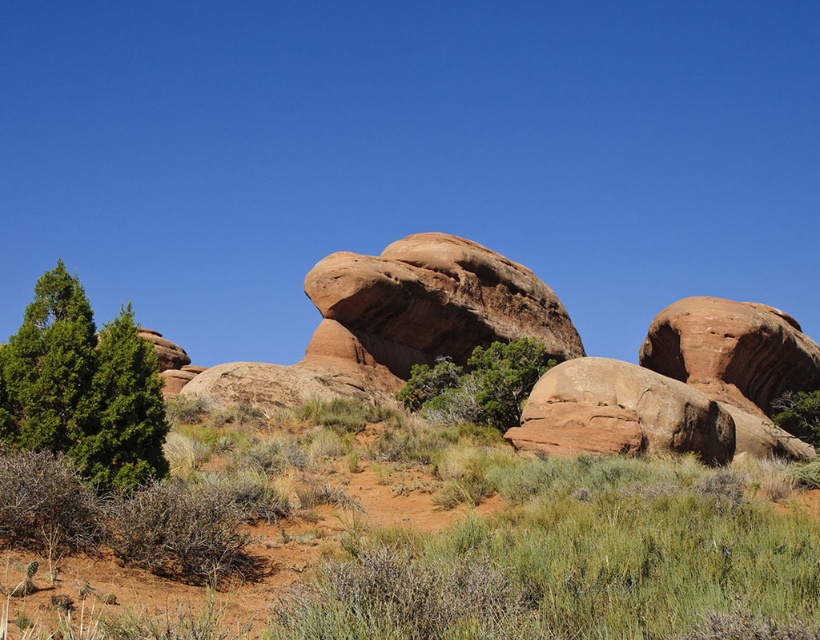
Question: Is green matte tree at left thinner than green leafy tree at center?

Choices:
 (A) yes
 (B) no

Answer: (A)

Question: Is rustic sandstone rock at center positioned behind green leafy tree at center?

Choices:
 (A) no
 (B) yes

Answer: (B)

Question: Among these points, which one is farthest from the camera?

Choices:
 (A) (392, 349)
 (B) (440, 417)
 (C) (481, 584)

Answer: (A)

Question: Among these objects, which one is farthest from the camera?

Choices:
 (A) green matte tree at left
 (B) green shrubbery at lower left
 (C) green leafy tree at center
 (D) rustic sandstone rock at center

Answer: (D)

Question: Which of these objects is positioned closest to the rustic sandstone rock at center?

Choices:
 (A) green matte tree at left
 (B) green shrubbery at lower left

Answer: (B)

Question: Is green shrubbery at lower left smaller than green leafy tree at center?

Choices:
 (A) yes
 (B) no

Answer: (B)